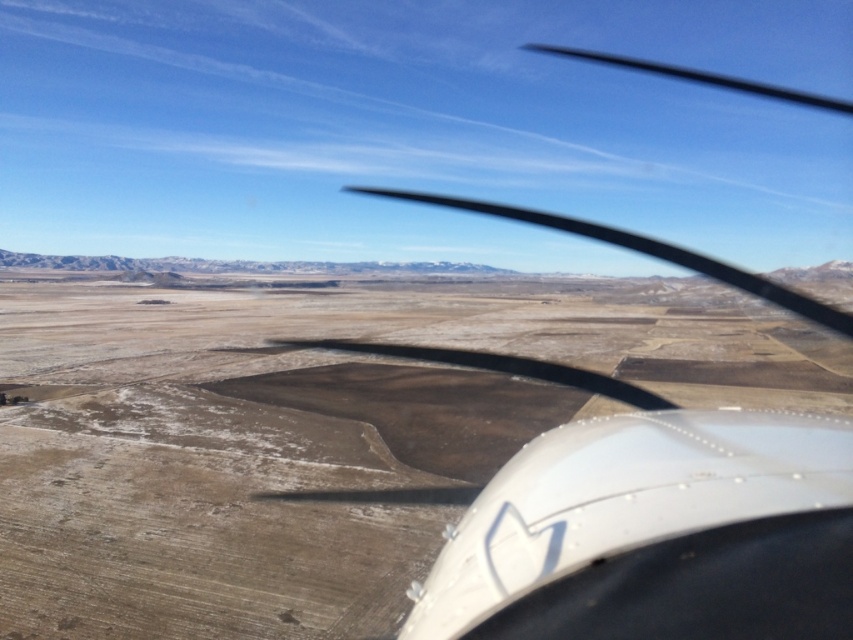
Does brown/dry soil at center have a lesser height compared to white matte wing at upper right?

Yes, brown/dry soil at center is shorter than white matte wing at upper right.

Who is positioned more to the right, brown/dry soil at center or white matte wing at upper right?

Positioned to the right is white matte wing at upper right.

Who is more forward, (84, 435) or (509, 637)?

Point (509, 637) is more forward.

Find the location of a particular element. This screenshot has height=640, width=853. brown/dry soil at center is located at coordinates (312, 435).